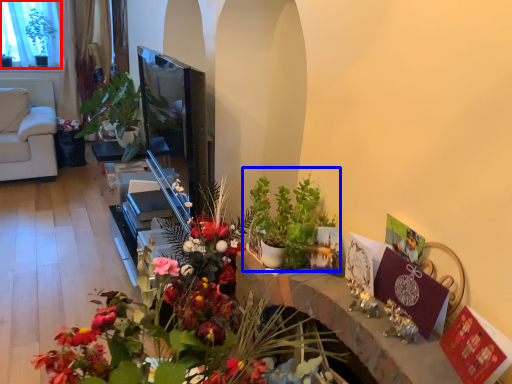
Question: Which object appears farthest to the camera in this image, window screen (highlighted by a red box) or houseplant (highlighted by a blue box)?

Choices:
 (A) window screen
 (B) houseplant

Answer: (A)